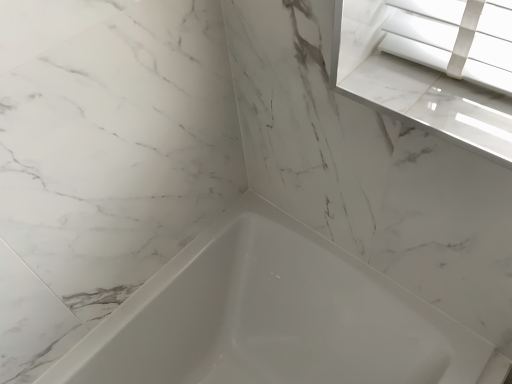
Question: Should I look upward or downward to see white glossy bathtub at center?

Choices:
 (A) up
 (B) down

Answer: (B)